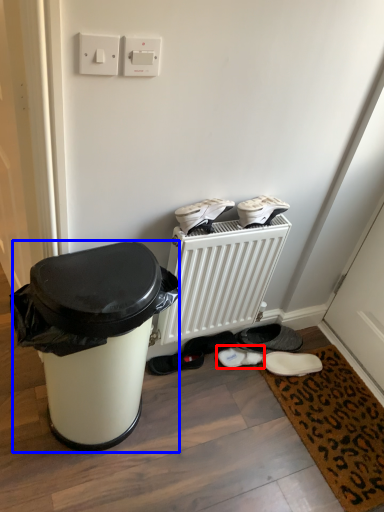
Question: Among these objects, which one is nearest to the camera, footwear (highlighted by a red box) or waste container (highlighted by a blue box)?

Choices:
 (A) footwear
 (B) waste container

Answer: (B)